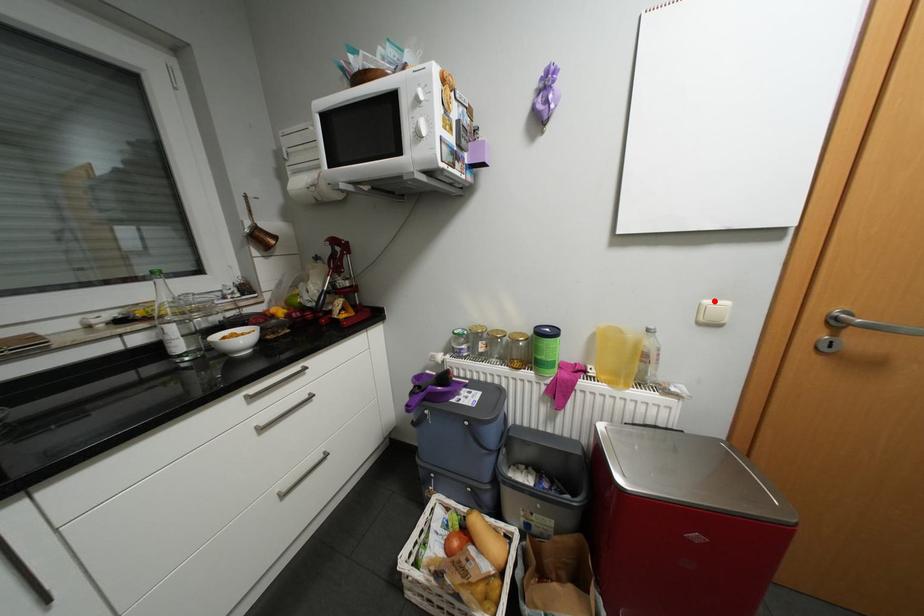
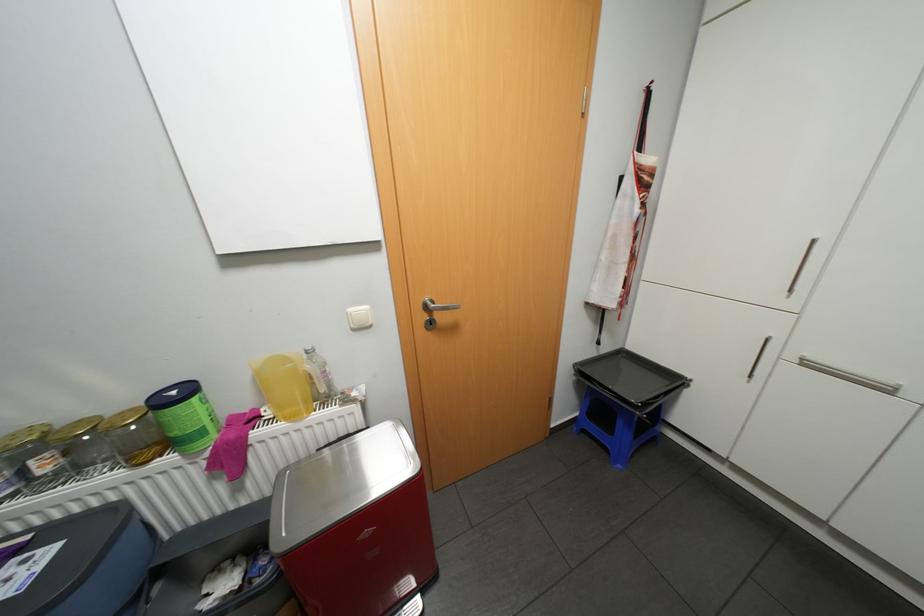
In the second image, find the point that corresponds to the highlighted location in the first image.

(358, 309)